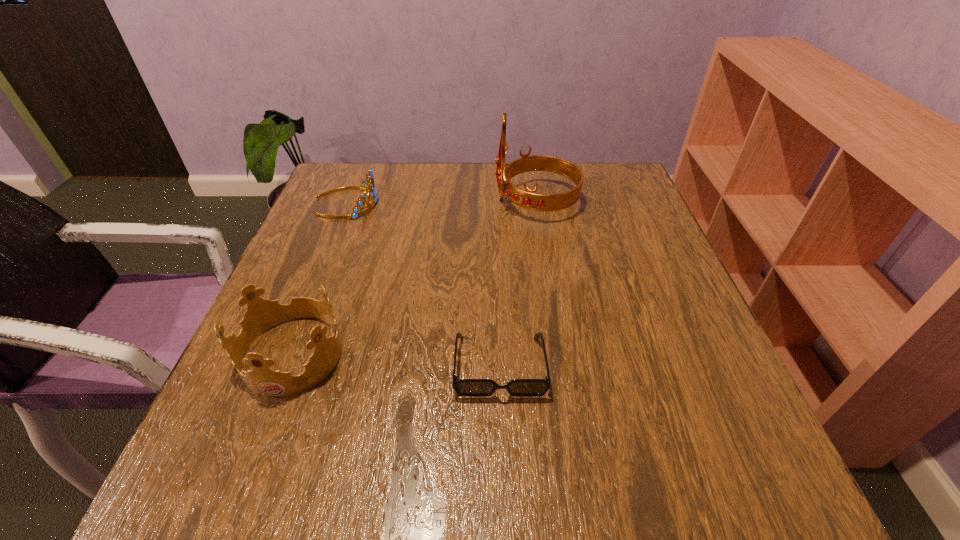
This screenshot has height=540, width=960. In order to click on object that is at the right edge in this screenshot , I will do `click(528, 199)`.

You are a GUI agent. You are given a task and a screenshot of the screen. Output one action in this format:
    pyautogui.click(x=<x>, y=<y>)
    Task: Click on the object that is positioned at the far left corner
    This screenshot has height=540, width=960.
    Given the screenshot: What is the action you would take?
    pyautogui.click(x=368, y=185)

This screenshot has height=540, width=960. I want to click on object positioned at the far right corner, so click(x=528, y=199).

Locate an element on the screen. This screenshot has width=960, height=540. vacant space at the far edge of the desktop is located at coordinates (445, 194).

Locate an element on the screen. The image size is (960, 540). vacant space at the left edge of the desktop is located at coordinates (270, 342).

Locate an element on the screen. This screenshot has height=540, width=960. free space at the right edge of the desktop is located at coordinates (668, 258).

The height and width of the screenshot is (540, 960). I want to click on free location at the far left corner, so click(360, 185).

The width and height of the screenshot is (960, 540). Identify the location of free space at the far right corner of the desktop. (609, 194).

Find the location of a particular element. vacant space at the near right corner is located at coordinates (768, 494).

Locate an element on the screen. empty location between the nearest tiara and the tallest tiara is located at coordinates (415, 278).